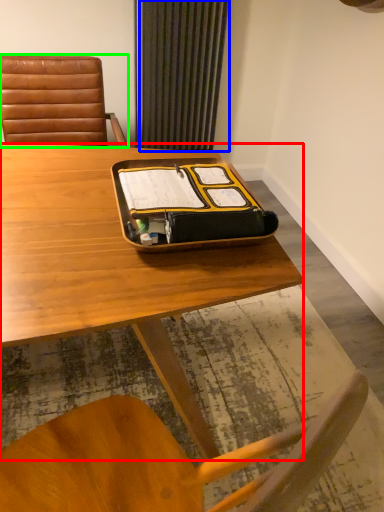
Question: Estimate the real-world distances between objects in this image. Which object is farther from desk (highlighted by a red box), curtain (highlighted by a blue box) or chair (highlighted by a green box)?

Choices:
 (A) curtain
 (B) chair

Answer: (A)